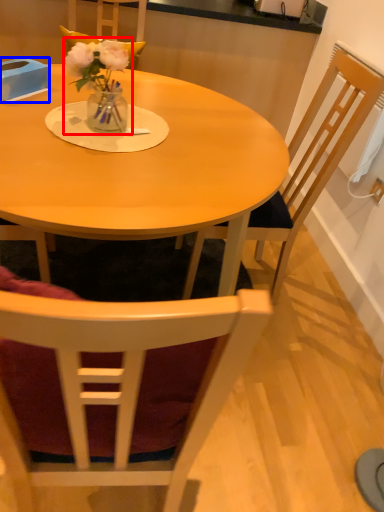
Question: Which of the following is the closest to the observer, floral arrangement (highlighted by a red box) or box (highlighted by a blue box)?

Choices:
 (A) floral arrangement
 (B) box

Answer: (A)